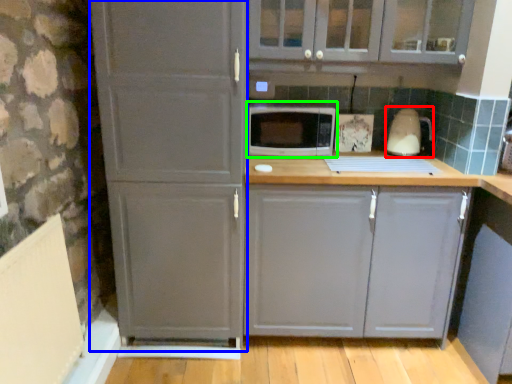
Question: Which object is positioned farthest from appliance (highlighted by a red box)? Select from screen door (highlighted by a blue box) and microwave oven (highlighted by a green box).

Choices:
 (A) screen door
 (B) microwave oven

Answer: (A)